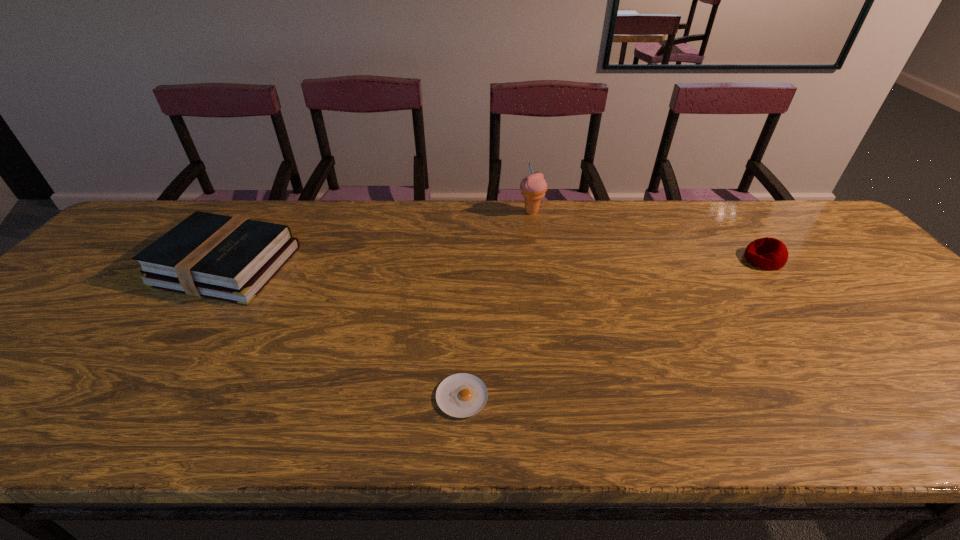
What are the coordinates of `vacant area at the far left corner` in the screenshot? It's located at (201, 205).

Identify the location of free spot between the second tallest object and the egg yolk. (344, 331).

Where is `free point between the leftmost object and the second shortest object`? This screenshot has height=540, width=960. free point between the leftmost object and the second shortest object is located at coordinates (494, 262).

Locate an element on the screen. vacant space that is in between the leftmost object and the icecream is located at coordinates (378, 239).

Where is `free point between the third shortest object and the icecream`? This screenshot has height=540, width=960. free point between the third shortest object and the icecream is located at coordinates (378, 239).

Locate an element on the screen. The width and height of the screenshot is (960, 540). unoccupied position between the second tallest object and the third object from right to left is located at coordinates (344, 331).

You are a GUI agent. You are given a task and a screenshot of the screen. Output one action in this format:
    pyautogui.click(x=<x>, y=<y>)
    Task: Click on the unoccupied position between the leftmost object and the tallest object
    Image resolution: width=960 pixels, height=540 pixels.
    Given the screenshot: What is the action you would take?
    [x=378, y=239]

Where is `empty space that is in between the farthest object and the second shortest object`? empty space that is in between the farthest object and the second shortest object is located at coordinates (648, 235).

This screenshot has height=540, width=960. I want to click on free space between the shortest object and the leftmost object, so click(344, 331).

This screenshot has height=540, width=960. In order to click on blank region between the nearest object and the icecream in this screenshot , I will do `click(496, 304)`.